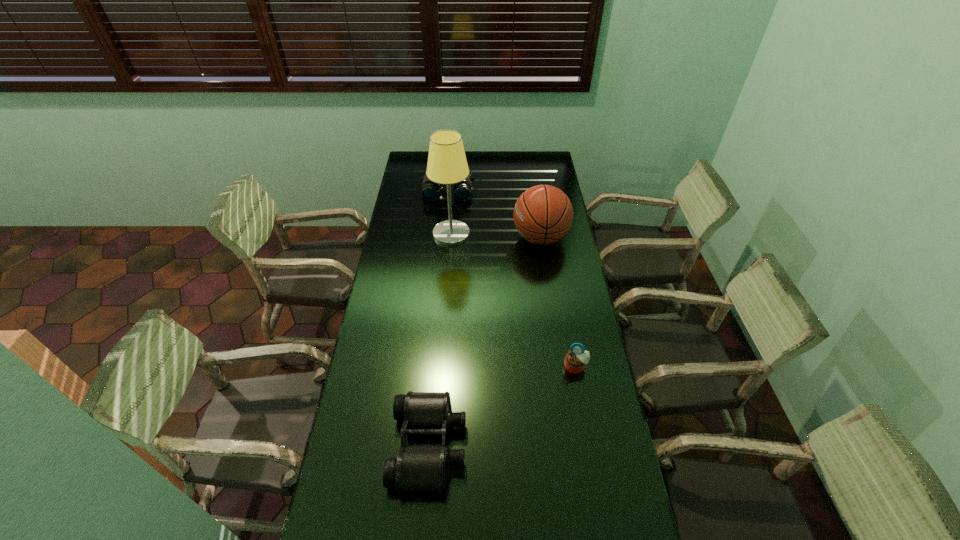
Locate an element on the screen. This screenshot has height=540, width=960. empty space that is in between the fourth shortest object and the farther binoculars is located at coordinates (494, 214).

You are a GUI agent. You are given a task and a screenshot of the screen. Output one action in this format:
    pyautogui.click(x=<x>, y=<y>)
    Task: Click on the free spot between the nearest object and the table lamp
    The height and width of the screenshot is (540, 960).
    Given the screenshot: What is the action you would take?
    pyautogui.click(x=441, y=339)

Where is `unoccupied area between the fourth farthest object and the nearest object`? This screenshot has height=540, width=960. unoccupied area between the fourth farthest object and the nearest object is located at coordinates (502, 406).

Identify the location of free area in between the third tallest object and the second nearest object. Image resolution: width=960 pixels, height=540 pixels. (512, 279).

Find the location of a particular element. This screenshot has width=960, height=540. vacant area between the nearest object and the muffin is located at coordinates 502,406.

Where is `free area in between the taller binoculars and the nearer binoculars`? free area in between the taller binoculars and the nearer binoculars is located at coordinates (439, 318).

Locate an element on the screen. This screenshot has width=960, height=540. free spot between the second nearest object and the shorter binoculars is located at coordinates (502, 406).

Identify the location of free space between the muffin and the basketball. (558, 302).

Choose which object is the fourth nearest neighbor to the nearer binoculars. Please provide its 2D coordinates. Your answer should be formatted as a tuple, i.e. [(x, y)], where the tuple contains the x and y coordinates of a point satisfying the conditions above.

[(430, 191)]

Find the location of a particular element. The height and width of the screenshot is (540, 960). the closest object to the taller binoculars is located at coordinates (447, 164).